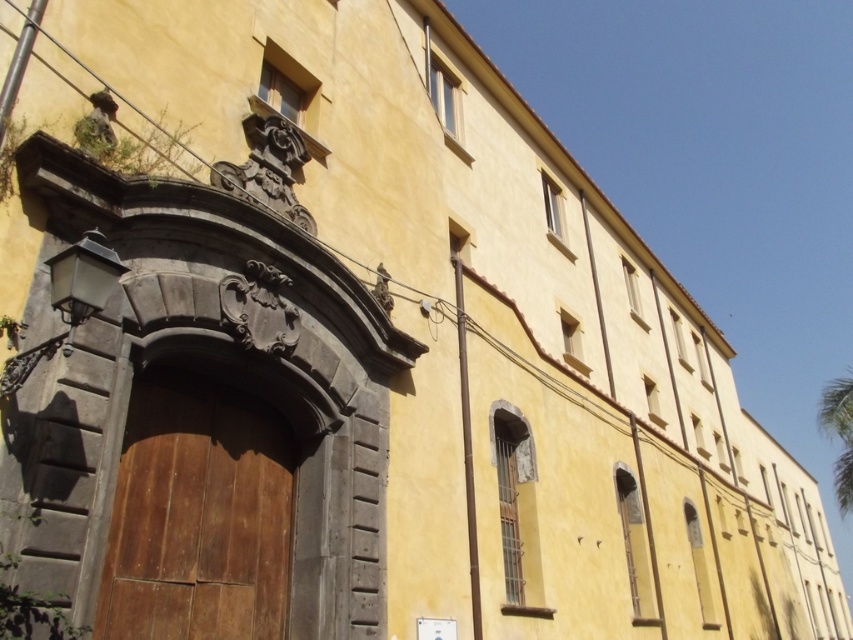
Question: Which of the following is the farthest from the observer?

Choices:
 (A) (251, 397)
 (B) (839, 397)

Answer: (B)

Question: Which object is farther from the camera taking this photo?

Choices:
 (A) wooden door at center
 (B) green leafy palm tree at upper right

Answer: (B)

Question: Considering the relative positions of wooden door at center and green leafy palm tree at upper right in the image provided, where is wooden door at center located with respect to green leafy palm tree at upper right?

Choices:
 (A) left
 (B) right

Answer: (A)

Question: Which point appears closest to the camera in this image?

Choices:
 (A) pyautogui.click(x=849, y=419)
 (B) pyautogui.click(x=206, y=385)

Answer: (B)

Question: Considering the relative positions of wooden door at center and green leafy palm tree at upper right in the image provided, where is wooden door at center located with respect to green leafy palm tree at upper right?

Choices:
 (A) right
 (B) left

Answer: (B)

Question: Can you confirm if wooden door at center is positioned above green leafy palm tree at upper right?

Choices:
 (A) yes
 (B) no

Answer: (A)